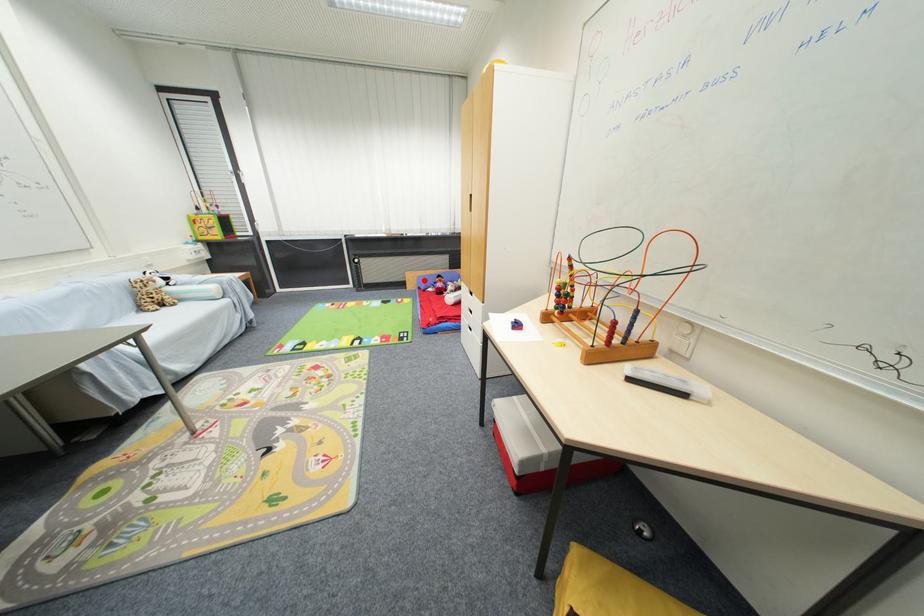
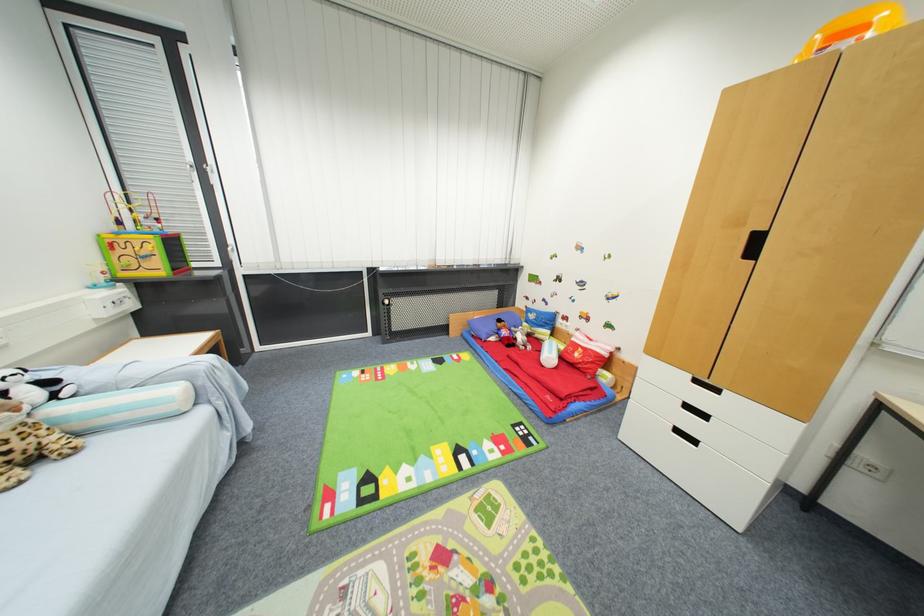
Question: I am providing you with two images of the same scene from different viewpoints. A red point is shown in image1. For the corresponding object point in image2, is it positioned nearer or farther from the camera?

Choices:
 (A) Nearer
 (B) Farther

Answer: (B)